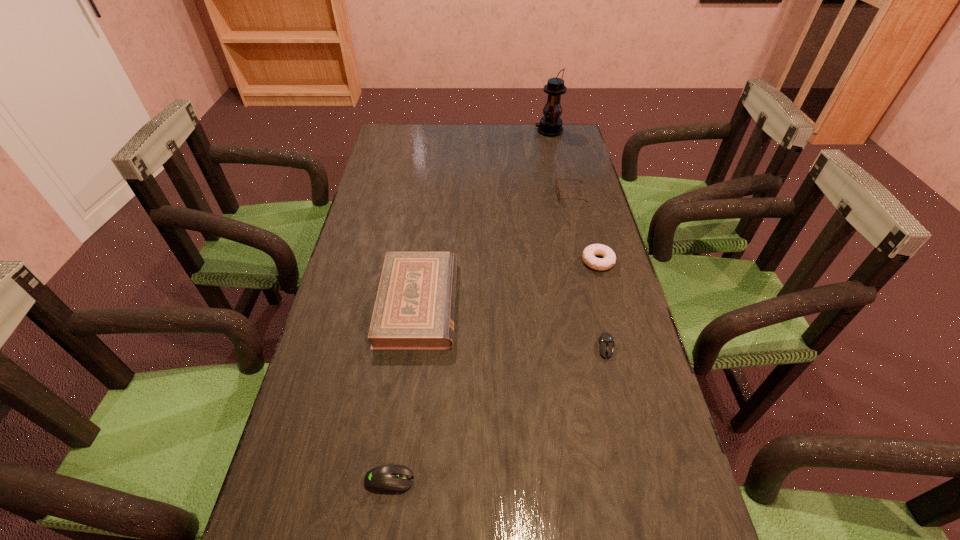
This screenshot has height=540, width=960. Find the location of `free point between the sunglasses and the tallest object`. free point between the sunglasses and the tallest object is located at coordinates (560, 163).

Where is `vacant area that lies between the Bible and the farther computer mouse`? This screenshot has height=540, width=960. vacant area that lies between the Bible and the farther computer mouse is located at coordinates (513, 326).

Identify the location of vacant area between the second farthest object and the farthest object. The image size is (960, 540). (560, 163).

You are a GUI agent. You are given a task and a screenshot of the screen. Output one action in this format:
    pyautogui.click(x=<x>, y=<y>)
    Task: Click on the vacant area between the tallest object and the fifth nearest object
    The height and width of the screenshot is (540, 960).
    Given the screenshot: What is the action you would take?
    pyautogui.click(x=560, y=163)

Where is `vacant space in between the fourth tallest object and the nearer computer mouse`? vacant space in between the fourth tallest object and the nearer computer mouse is located at coordinates (x=493, y=371).

In order to click on vacant space that is in between the fourth tallest object and the farthest object in this screenshot , I will do `click(573, 196)`.

What are the coordinates of `empty space between the shorter computer mouse and the third shortest object` in the screenshot? It's located at (602, 305).

At what (x,y) coordinates should I click in order to perform the action: click on free space that is in between the tallest object and the shortest object. Please return your answer as a coordinate pair (x, y). The image size is (960, 540). Looking at the image, I should click on (578, 240).

Find the location of `empty space between the tallest object and the sunglasses`. empty space between the tallest object and the sunglasses is located at coordinates (560, 163).

At what (x,y) coordinates should I click in order to perform the action: click on free spot between the doughnut and the shorter computer mouse. Please return your answer as a coordinate pair (x, y). This screenshot has width=960, height=540. Looking at the image, I should click on (602, 305).